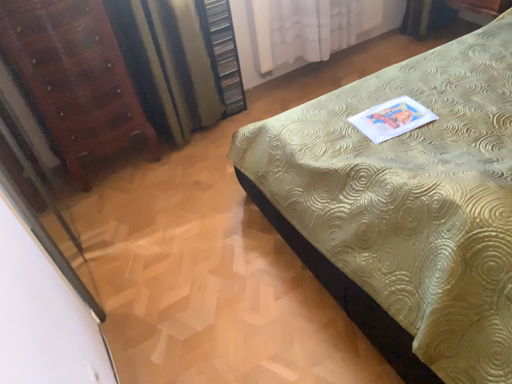
I want to click on empty space that is in between striped fabric curtain at left, marked as the first curtain in a left-to-right arrangement, and transparent glass screen door at left, so click(153, 214).